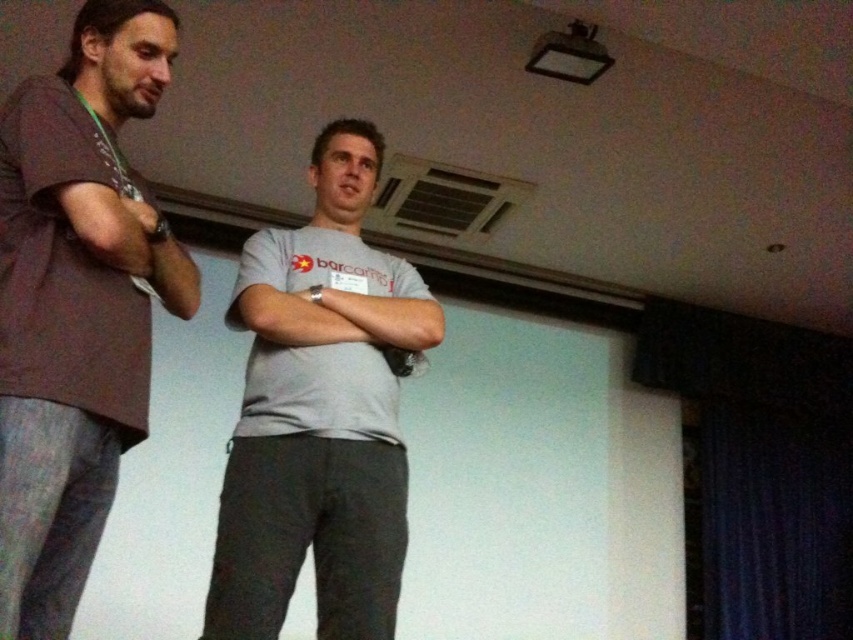
You are standing in the room where the two people are. You need to move from the point at coordinate point (102,260) to the point at coordinate point (322,600). Which direction should you move to get closer to your destination?

You should move backward because point (102,260) is in front of point (322,600), meaning the destination is behind you relative to your starting position.